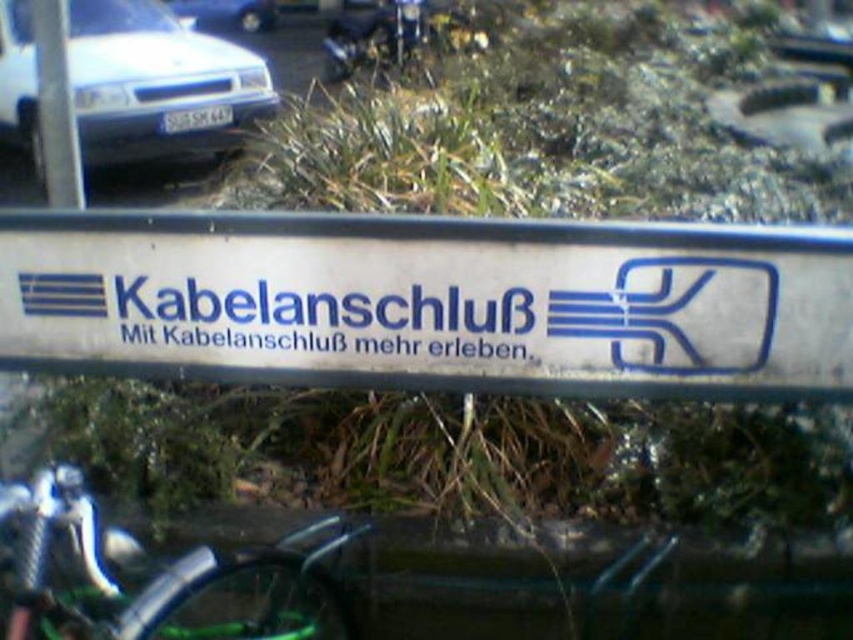
Question: Is metallic pole at upper left positioned behind white glossy car at upper left?

Choices:
 (A) yes
 (B) no

Answer: (B)

Question: Which object is farther from the camera taking this photo?

Choices:
 (A) white matte car at upper left
 (B) shiny metallic bicycle handlebar at lower left
 (C) metallic pole at upper left

Answer: (A)

Question: Which of the following is the closest to the observer?

Choices:
 (A) (209, 570)
 (B) (550, 316)
 (C) (82, 16)
 (D) (262, 8)

Answer: (A)

Question: Estimate the real-world distances between objects in this image. Which object is closer to the white glossy car at upper left?

Choices:
 (A) white matte car at upper left
 (B) shiny metallic bicycle handlebar at lower left

Answer: (A)

Question: Does white metallic sign at center appear on the left side of shiny metallic bicycle handlebar at lower left?

Choices:
 (A) yes
 (B) no

Answer: (B)

Question: Can you confirm if white metallic sign at center is bigger than white matte car at upper left?

Choices:
 (A) no
 (B) yes

Answer: (A)